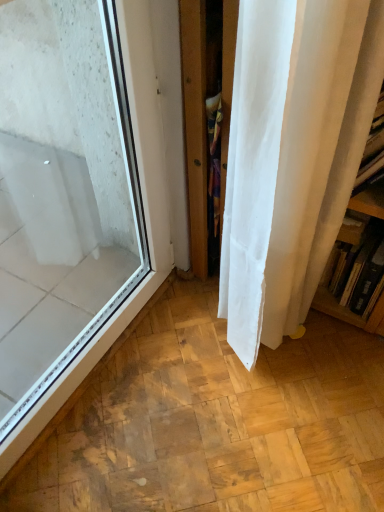
The width and height of the screenshot is (384, 512). What do you see at coordinates (81, 207) in the screenshot?
I see `transparent glass window at left` at bounding box center [81, 207].

From the picture: Measure the distance between point (44, 379) and camera.

Point (44, 379) and camera are 1.01 meters apart from each other.

The height and width of the screenshot is (512, 384). Identify the location of transparent glass window at left. (81, 207).

Measure the distance between transparent glass window at left and camera.

transparent glass window at left is 28.31 inches from camera.

Identify the location of wooden bookshelf at right. This screenshot has width=384, height=512. (353, 264).

Image resolution: width=384 pixels, height=512 pixels. What do you see at coordinates (353, 264) in the screenshot? I see `wooden bookshelf at right` at bounding box center [353, 264].

Find the location of a particular element. Image resolution: width=384 pixels, height=512 pixels. transparent glass window at left is located at coordinates (81, 207).

Is transparent glass window at left at the right side of wooden bookshelf at right?

No.

Which is behind, transparent glass window at left or wooden bookshelf at right?

wooden bookshelf at right is further away from the camera.

Is point (96, 42) positioned in front of point (373, 313)?

That is True.

From the image's perspective, is transparent glass window at left located beneath wooden bookshelf at right?

Correct, transparent glass window at left appears lower than wooden bookshelf at right in the image.

From a real-world perspective, does transparent glass window at left stand above wooden bookshelf at right?

Correct, in the physical world, transparent glass window at left is higher than wooden bookshelf at right.

Considering the sizes of objects transparent glass window at left and wooden bookshelf at right in the image provided, who is wider, transparent glass window at left or wooden bookshelf at right?

wooden bookshelf at right.

Does transparent glass window at left have a lesser height compared to wooden bookshelf at right?

In fact, transparent glass window at left may be taller than wooden bookshelf at right.

Who is bigger, transparent glass window at left or wooden bookshelf at right?

Bigger between the two is transparent glass window at left.

Is transparent glass window at left spatially inside wooden bookshelf at right, or outside of it?

transparent glass window at left lies outside wooden bookshelf at right.

Is transparent glass window at left next to wooden bookshelf at right and touching it?

No, transparent glass window at left is not beside wooden bookshelf at right.

Is transparent glass window at left positioned with its back to wooden bookshelf at right?

No, transparent glass window at left is not facing away from wooden bookshelf at right.

What's the angular difference between transparent glass window at left and wooden bookshelf at right's facing directions?

89.6 degrees.

Based on the photo, measure the distance from transparent glass window at left to wooden bookshelf at right.

transparent glass window at left is 66.83 centimeters away from wooden bookshelf at right.

Find the location of a particular element. This screenshot has height=512, width=384. window below the wooden bookshelf at right (from the image's perspective) is located at coordinates (81, 207).

Considering the positions of objects wooden bookshelf at right and transparent glass window at left in the image provided, who is more to the right, wooden bookshelf at right or transparent glass window at left?

From the viewer's perspective, wooden bookshelf at right appears more on the right side.

From the picture: Considering the positions of objects wooden bookshelf at right and transparent glass window at left in the image provided, who is behind, wooden bookshelf at right or transparent glass window at left?

wooden bookshelf at right is further away from the camera.

Which is in front, point (366, 234) or point (20, 352)?

The point (366, 234) is closer.

From the image's perspective, is wooden bookshelf at right located above transparent glass window at left?

Yes, from the image's perspective, wooden bookshelf at right is on top of transparent glass window at left.

From a real-world perspective, is wooden bookshelf at right above or below transparent glass window at left?

In terms of real-world spatial position, wooden bookshelf at right is below transparent glass window at left.

Does wooden bookshelf at right have a lesser width compared to transparent glass window at left?

No, wooden bookshelf at right is not thinner than transparent glass window at left.

Does wooden bookshelf at right have a lesser height compared to transparent glass window at left?

Yes.

Is wooden bookshelf at right bigger or smaller than transparent glass window at left?

Clearly, wooden bookshelf at right is smaller in size than transparent glass window at left.

Is transparent glass window at left completely or partially inside wooden bookshelf at right?

That's incorrect, transparent glass window at left is not inside wooden bookshelf at right.

Is wooden bookshelf at right directly adjacent to transparent glass window at left?

No.

Is wooden bookshelf at right oriented towards transparent glass window at left?

No, wooden bookshelf at right is not aimed at transparent glass window at left.

In order to click on bookshelf behind the transparent glass window at left in this screenshot , I will do `click(353, 264)`.

At what (x,y) coordinates should I click in order to perform the action: click on window that appears below the wooden bookshelf at right (from the image's perspective). Please return your answer as a coordinate pair (x, y). Looking at the image, I should click on (81, 207).

You are a GUI agent. You are given a task and a screenshot of the screen. Output one action in this format:
    pyautogui.click(x=<x>, y=<y>)
    Task: Click on the bookshelf lying on the right of transparent glass window at left
    
    Given the screenshot: What is the action you would take?
    pyautogui.click(x=353, y=264)